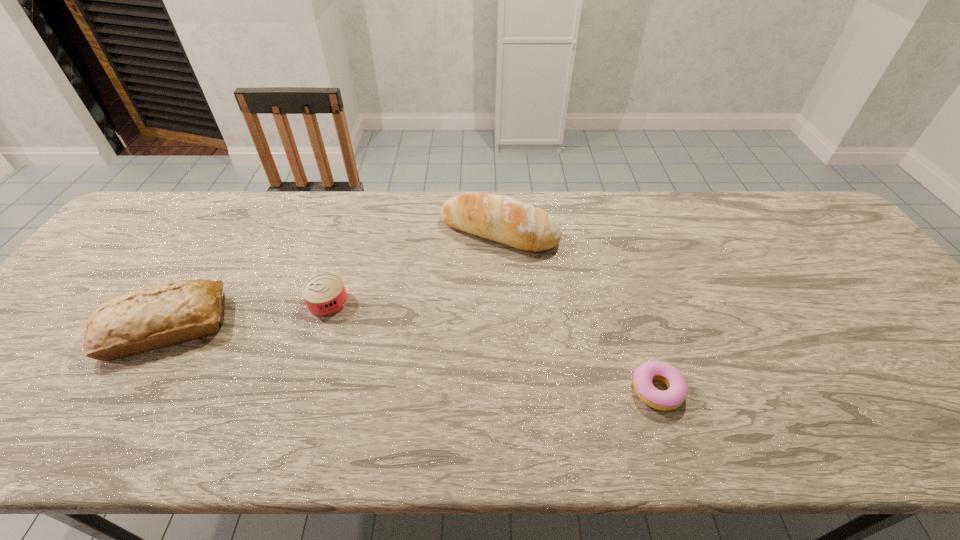
You are a GUI agent. You are given a task and a screenshot of the screen. Output one action in this format:
    pyautogui.click(x=<x>, y=<y>)
    Task: Click on the free space located on the front of the second object from left to right
    This screenshot has width=960, height=540.
    Given the screenshot: What is the action you would take?
    pyautogui.click(x=284, y=441)

The image size is (960, 540). I want to click on vacant space located 0.280m on the right of the rightmost object, so click(x=810, y=390).

Find the location of a particular element. This screenshot has width=960, height=540. object situated at the far edge is located at coordinates (504, 219).

Find the location of a particular element. object that is at the near edge is located at coordinates (670, 399).

Where is `object positioned at the left edge`? object positioned at the left edge is located at coordinates (155, 317).

What are the coordinates of `vacant point at the far edge` in the screenshot? It's located at [493, 192].

What are the coordinates of `vacant space at the near edge` in the screenshot? It's located at (471, 441).

In the image, there is a desktop. Identify the location of free space at the left edge. The image size is (960, 540). (60, 357).

Identify the location of vacant region at the right edge. The image size is (960, 540). (843, 260).

At what (x,y) coordinates should I click in order to perform the action: click on free space at the far right corner of the desktop. Please return your answer as a coordinate pair (x, y). Looking at the image, I should click on (787, 201).